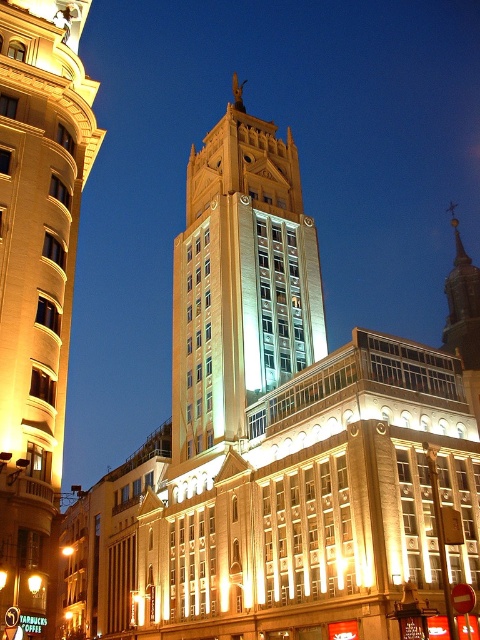
Question: Does matte gold building at center appear over golden stone bell tower at center?

Choices:
 (A) no
 (B) yes

Answer: (A)

Question: Is matte gold building at center above golden stone bell tower at center?

Choices:
 (A) yes
 (B) no

Answer: (B)

Question: Which point is closer to the camera taking this photo?

Choices:
 (A) (4, 216)
 (B) (236, 243)

Answer: (A)

Question: Which point is farther from the camera taking this photo?

Choices:
 (A) (188, 323)
 (B) (80, 124)

Answer: (A)

Question: Does matte gold building at center appear over golden stone bell tower at center?

Choices:
 (A) no
 (B) yes

Answer: (A)

Question: Which object is farther from the camera taking this photo?

Choices:
 (A) golden stone bell tower at center
 (B) matte gold building at center

Answer: (A)